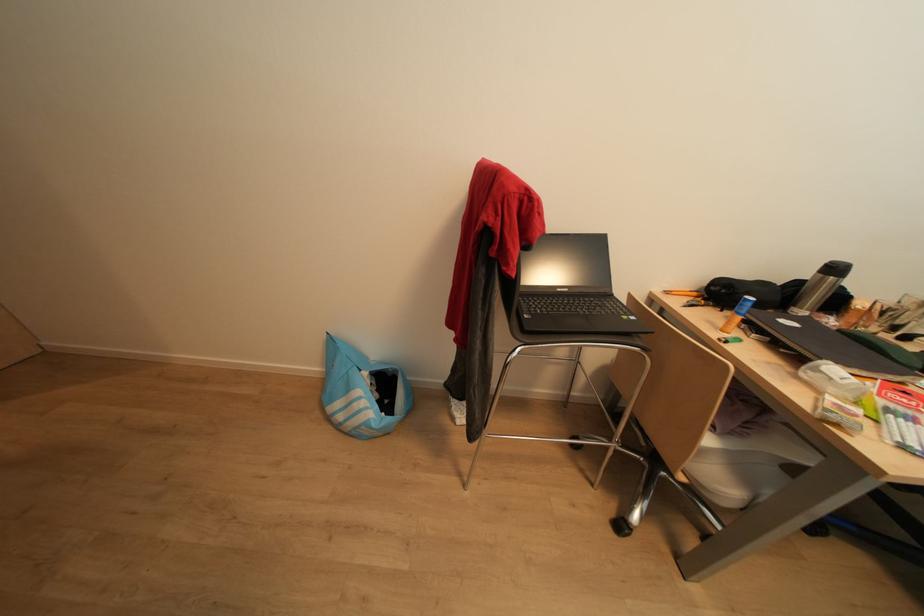
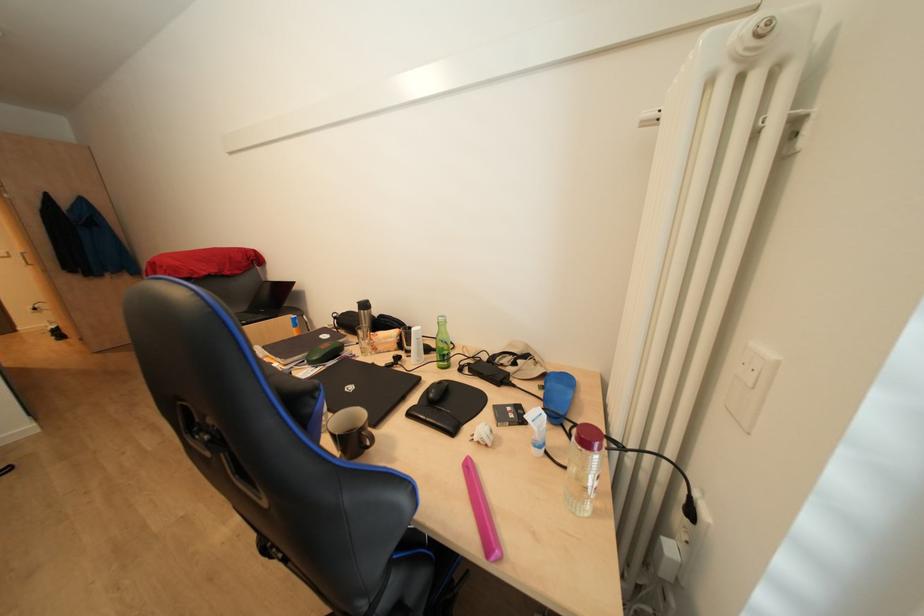
Question: What movement of the cameraman would produce the second image?

Choices:
 (A) Left
 (B) Right
 (C) Forward
 (D) Backward

Answer: (B)